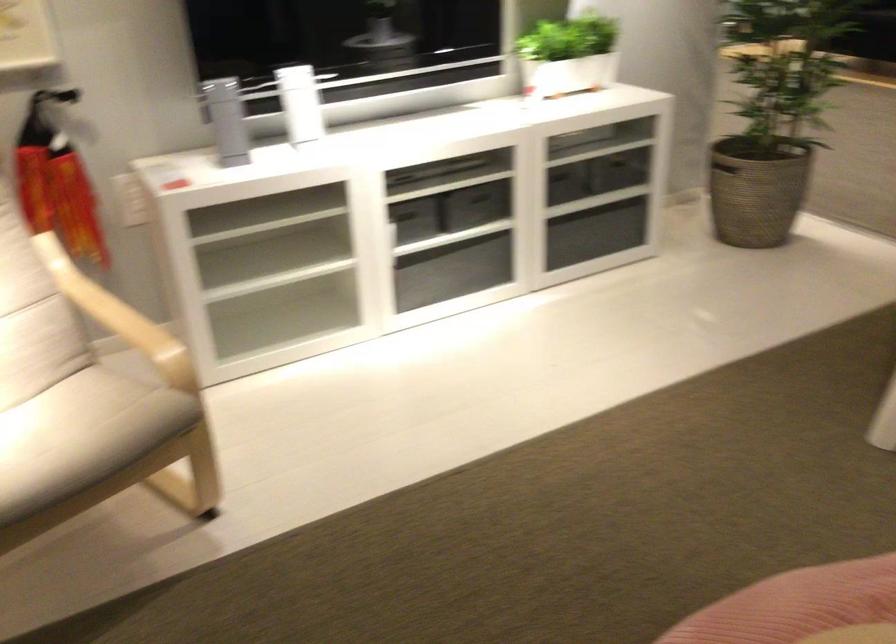
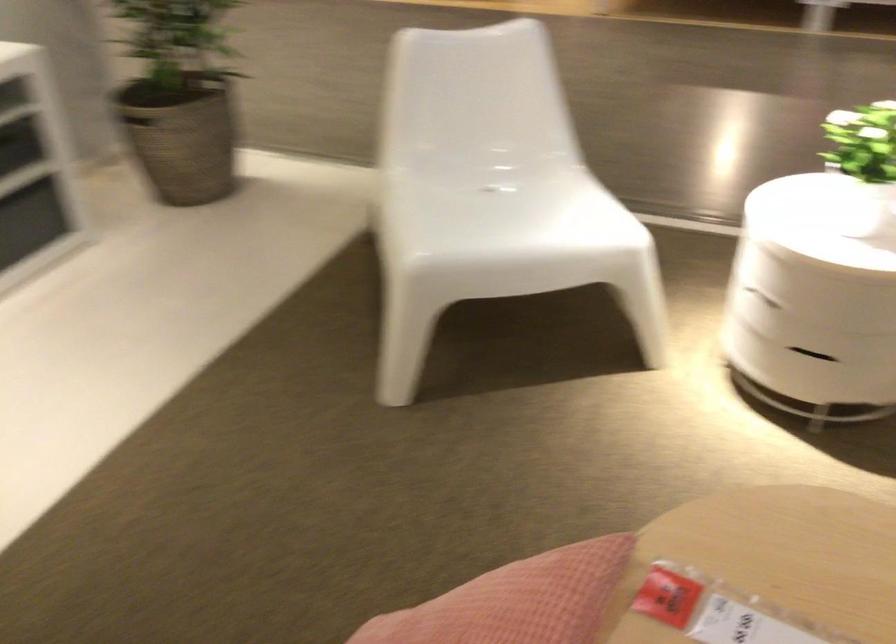
Question: The first image is from the beginning of the video and the second image is from the end. How did the camera likely rotate when shooting the video?

Choices:
 (A) Left
 (B) Right
 (C) Up
 (D) Down

Answer: (B)